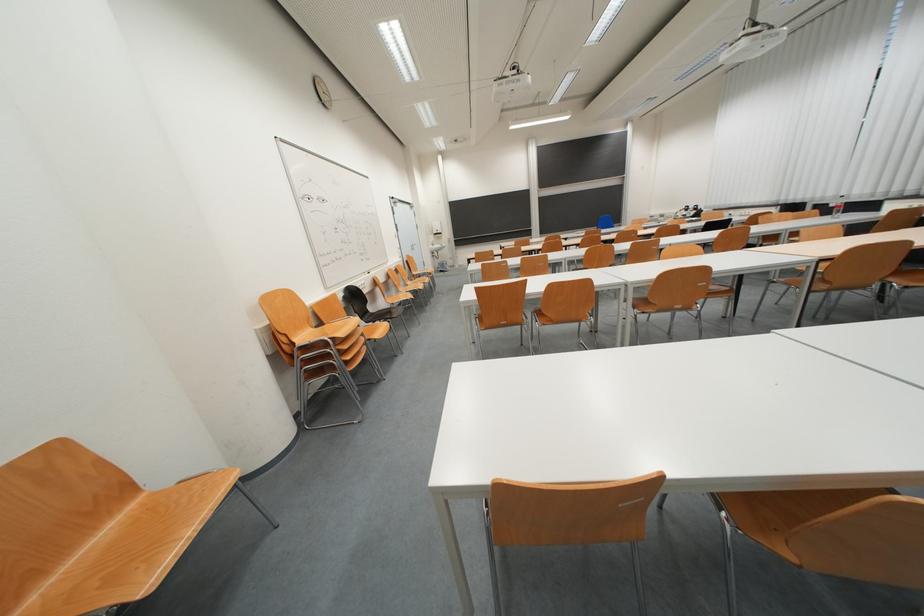
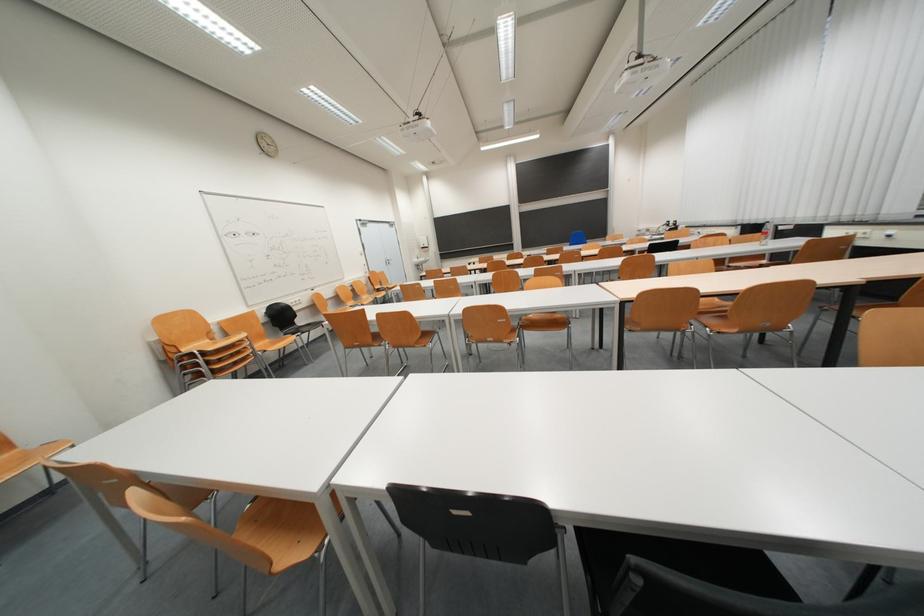
Question: What movement of the cameraman would produce the second image?

Choices:
 (A) Left
 (B) Right
 (C) Forward
 (D) Backward

Answer: (B)